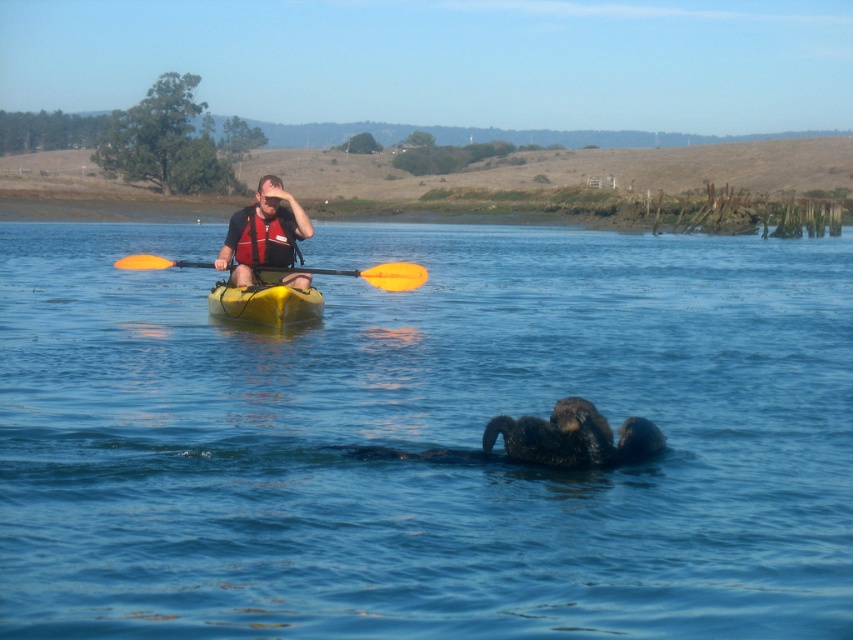
Between yellow matte canoe at center and red life jacket at center, which one has less height?

yellow matte canoe at center

You are a GUI agent. You are given a task and a screenshot of the screen. Output one action in this format:
    pyautogui.click(x=<x>, y=<y>)
    Task: Click on the yellow matte canoe at center
    
    Given the screenshot: What is the action you would take?
    pyautogui.click(x=265, y=304)

Which is in front, point (289, 316) or point (268, 237)?

Point (289, 316) is more forward.

Identify the location of yellow matte canoe at center. (265, 304).

Does matte red life vest at center have a larger size compared to yellow matte canoe at center?

Correct, matte red life vest at center is larger in size than yellow matte canoe at center.

Does matte red life vest at center appear on the right side of yellow matte canoe at center?

In fact, matte red life vest at center is to the left of yellow matte canoe at center.

Between point (251, 280) and point (271, 298), which one is positioned behind?

Point (251, 280)

I want to click on matte red life vest at center, so click(x=263, y=232).

Does point (302, 292) lie in front of point (389, 289)?

Yes, point (302, 292) is in front of point (389, 289).

Can you confirm if yellow matte canoe at center is positioned to the left of orange plastic paddle at center?

Incorrect, yellow matte canoe at center is not on the left side of orange plastic paddle at center.

Identify the location of yellow matte canoe at center. This screenshot has height=640, width=853. (265, 304).